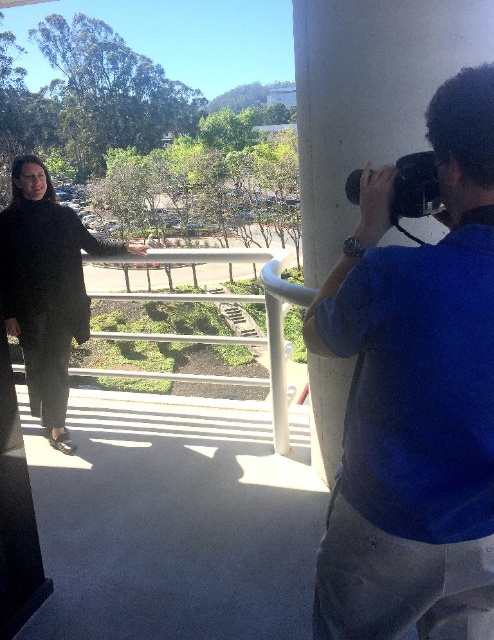
Question: Does black textured coat at left appear on the right side of black plastic camera at upper right?

Choices:
 (A) yes
 (B) no

Answer: (B)

Question: Which of the following is the farthest from the observer?

Choices:
 (A) (430, 196)
 (B) (371, 428)

Answer: (A)

Question: Does blue cotton shirt at right appear on the right side of black plastic camera at upper right?

Choices:
 (A) yes
 (B) no

Answer: (A)

Question: Which point is farther from the camera taking this photo?

Choices:
 (A) (423, 173)
 (B) (492, 592)
 (C) (53, 296)

Answer: (C)

Question: Does blue cotton shirt at right appear on the right side of black textured coat at left?

Choices:
 (A) yes
 (B) no

Answer: (A)

Question: Which of these objects is positioned closest to the blue cotton shirt at right?

Choices:
 (A) black textured coat at left
 (B) black plastic camera at upper right

Answer: (B)